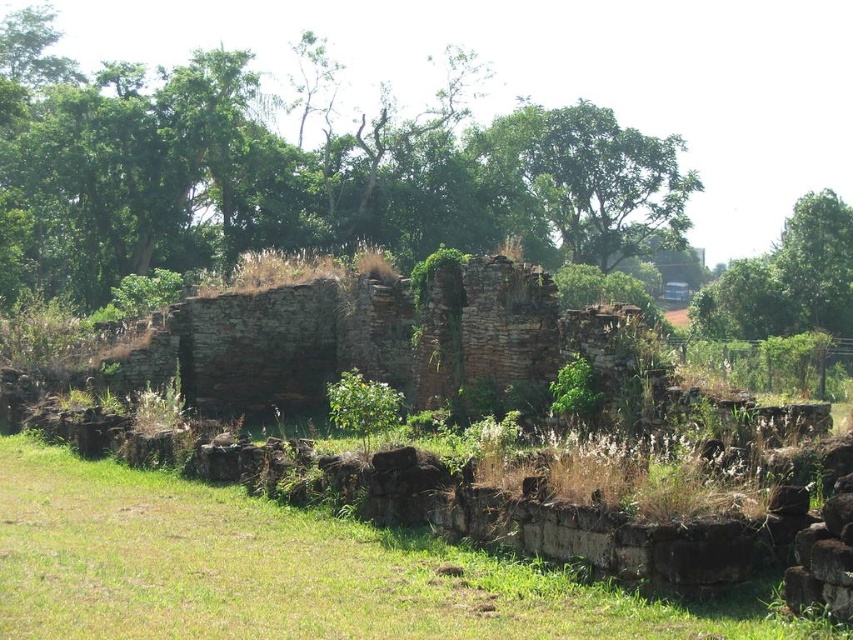
Is point (595, 241) positioned after point (161, 605)?

Yes.

You are a GUI agent. You are given a task and a screenshot of the screen. Output one action in this format:
    pyautogui.click(x=<x>, y=<y>)
    Task: Click on the green leafy tree at center
    The height and width of the screenshot is (640, 853).
    Given the screenshot: What is the action you would take?
    pyautogui.click(x=296, y=173)

Measure the distance between point (142, 113) and camera.

Point (142, 113) is 135.33 meters from camera.

Locate an element on the screen. The image size is (853, 640). green leafy tree at center is located at coordinates (296, 173).

Can you confirm if green leafy tree at center is smaller than green leafy tree at upper center?

No.

Who is more distant from viewer, (112, 77) or (605, 115)?

Point (605, 115)

Looking at this image, who is more forward, [631,212] or [579,230]?

Positioned in front is point [579,230].

Identify the location of green leafy tree at center. (296, 173).

Can you confirm if green grass at lower center is positioned to the right of green leafy tree at upper center?

In fact, green grass at lower center is to the left of green leafy tree at upper center.

Is green grass at lower center in front of green leafy tree at upper center?

Yes, green grass at lower center is in front of green leafy tree at upper center.

Is point (26, 436) closer to viewer compared to point (521, 182)?

Yes, it is in front of point (521, 182).

Locate an element on the screen. The image size is (853, 640). green grass at lower center is located at coordinates (291, 572).